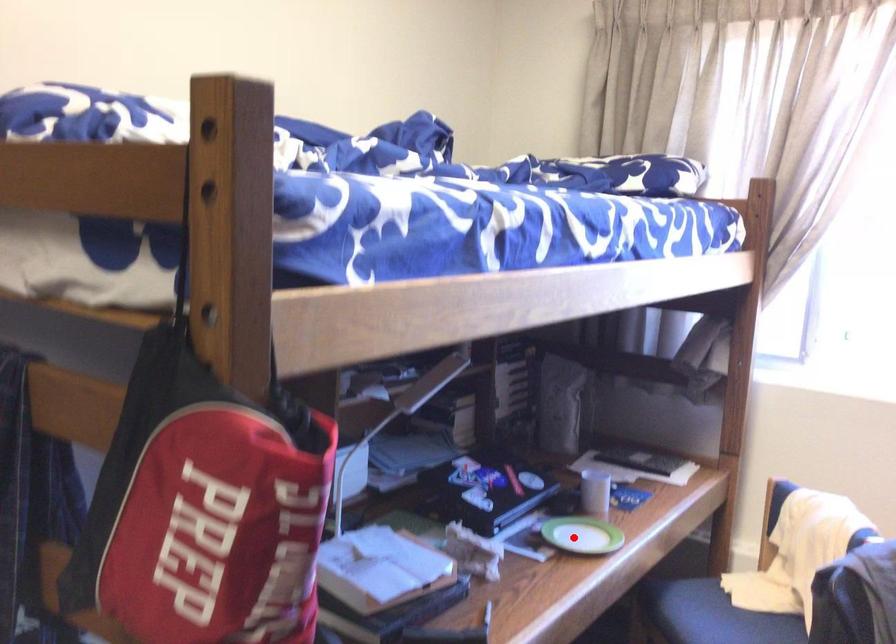
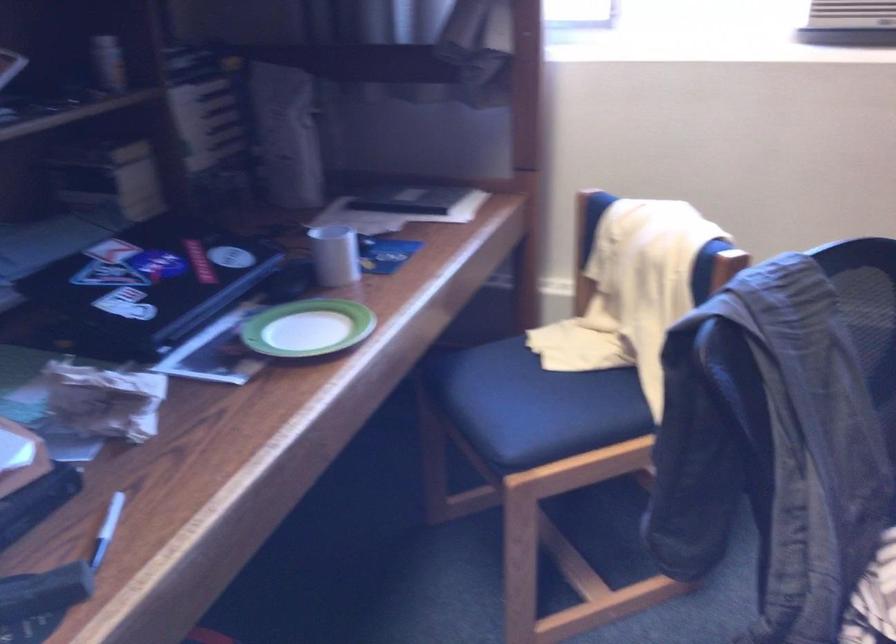
Locate, in the second image, the point that corresponds to the highlighted location in the first image.

(307, 328)